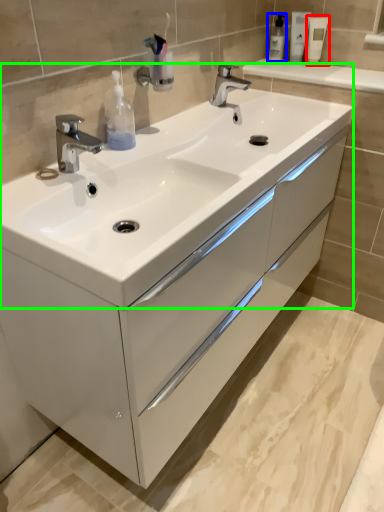
Question: Which is farther away from mouthwash (highlighted by a red box)? mouthwash (highlighted by a blue box) or sink (highlighted by a green box)?

Choices:
 (A) mouthwash
 (B) sink

Answer: (B)